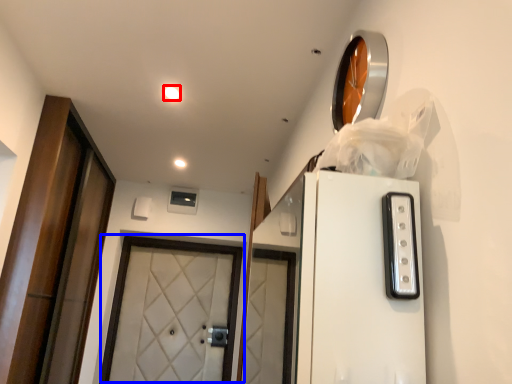
Question: Which of the following is the farthest to the observer, lighting (highlighted by a red box) or door (highlighted by a blue box)?

Choices:
 (A) lighting
 (B) door

Answer: (B)